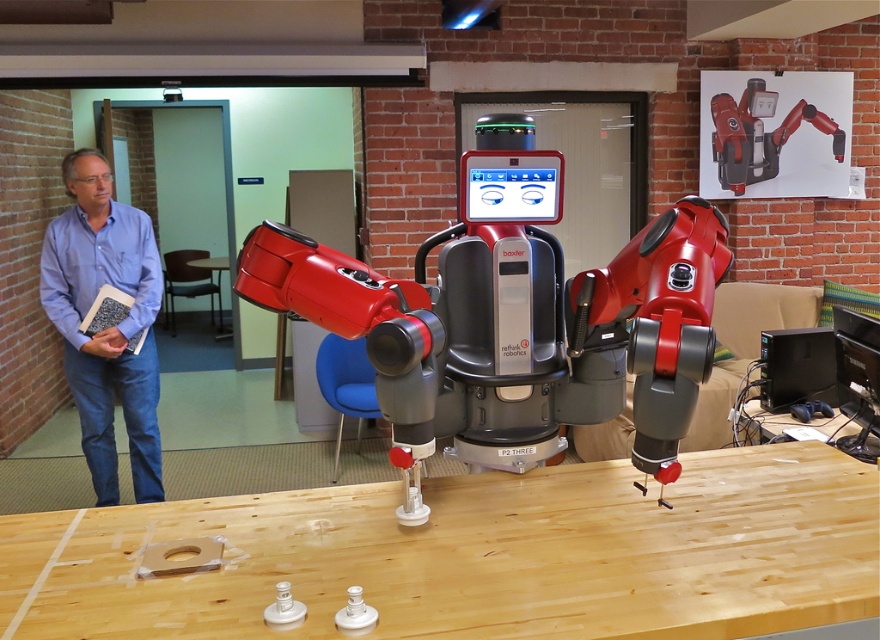
Between blue denim jeans at left and brown leather chair at center, which one has less height?

brown leather chair at center

Does blue denim jeans at left come behind brown leather chair at center?

No, blue denim jeans at left is closer to the viewer.

Is point (93, 465) farther from viewer compared to point (191, 252)?

No, it is not.

Where is `blue denim jeans at left`? The width and height of the screenshot is (880, 640). blue denim jeans at left is located at coordinates (110, 326).

Can you confirm if light brown wood table at center is bigger than metallic red robot at center?

No, light brown wood table at center is not bigger than metallic red robot at center.

What do you see at coordinates (477, 556) in the screenshot?
I see `light brown wood table at center` at bounding box center [477, 556].

Does point (622, 465) come closer to viewer compared to point (701, 326)?

No, it is behind (701, 326).

I want to click on light brown wood table at center, so click(477, 556).

Is blue plastic chair at center thinner than wooden table at center?

Correct, blue plastic chair at center's width is less than wooden table at center's.

From the picture: Can you confirm if blue plastic chair at center is shorter than wooden table at center?

No.

This screenshot has width=880, height=640. Find the location of `blue plastic chair at center`. blue plastic chair at center is located at coordinates (346, 385).

This screenshot has width=880, height=640. Find the location of `blue plastic chair at center`. blue plastic chair at center is located at coordinates (346, 385).